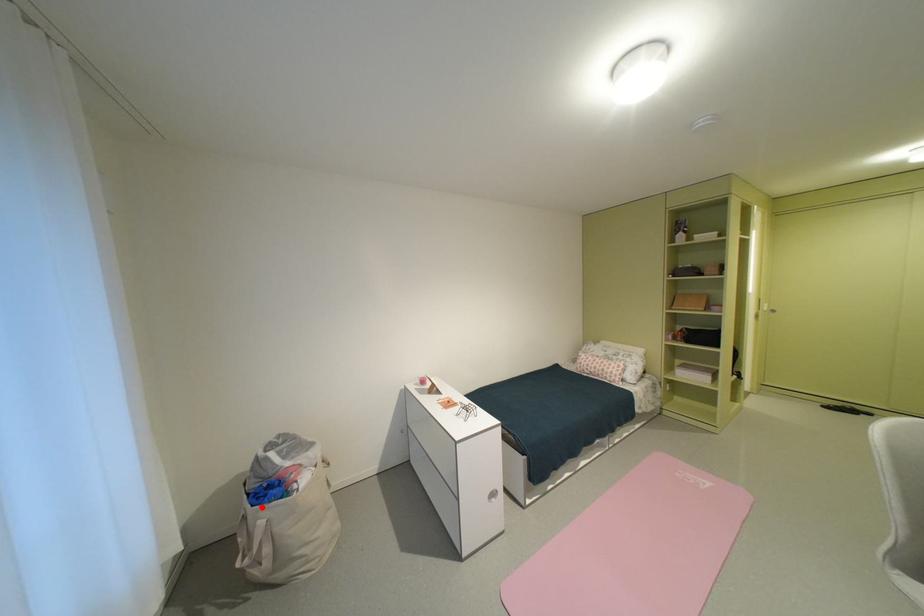
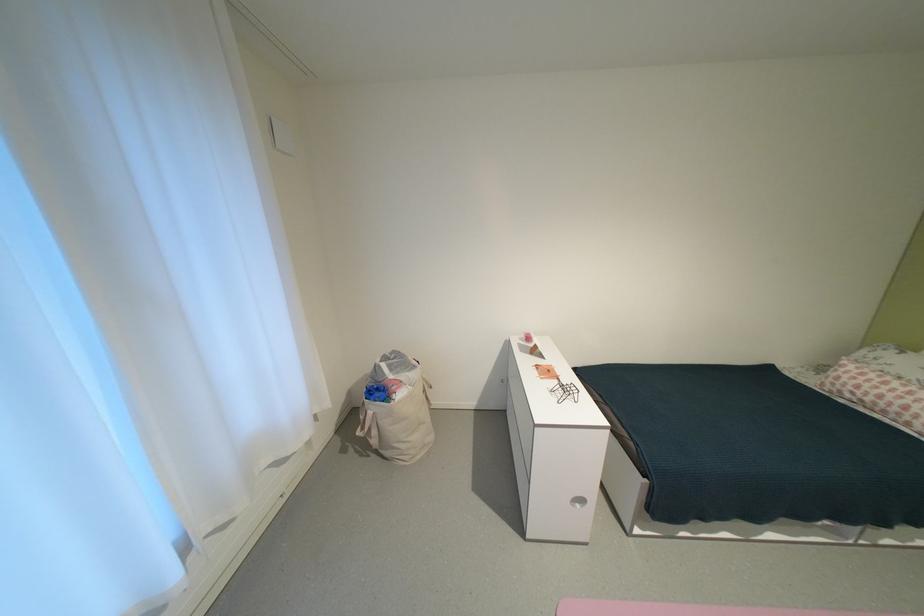
Where in the second image is the point corresponding to the highlighted location from the first image?

(375, 400)